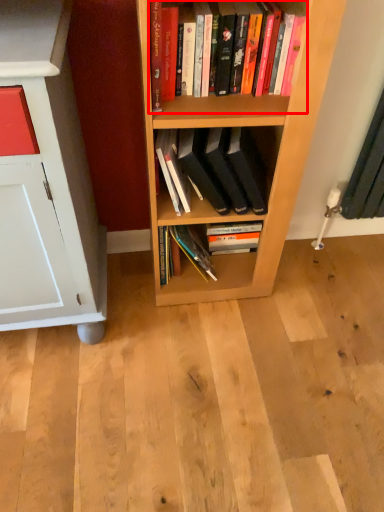
Question: From the image's perspective, where is book (annotated by the red box) located in relation to book in the image?

Choices:
 (A) above
 (B) below

Answer: (A)